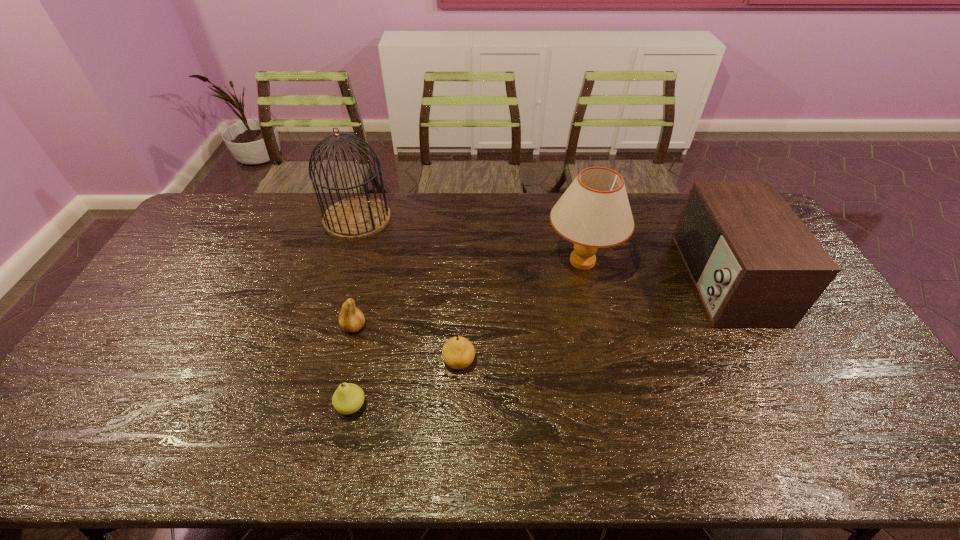
Identify the location of birdcage. (357, 217).

The height and width of the screenshot is (540, 960). Find the location of `lampshade`. lampshade is located at coordinates (594, 212).

Find the location of a particular element. The image size is (960, 540). radio receiver is located at coordinates (754, 264).

Identify the location of the rightmost object. (754, 264).

Image resolution: width=960 pixels, height=540 pixels. In order to click on the farthest pear in this screenshot , I will do `click(351, 319)`.

This screenshot has width=960, height=540. Identify the location of the second nearest object. click(x=458, y=352).

This screenshot has height=540, width=960. What are the coordinates of `the third object from right to left` in the screenshot? It's located at (458, 352).

Locate an element on the screen. Image resolution: width=960 pixels, height=540 pixels. the nearest object is located at coordinates (348, 398).

You are a GUI agent. You are given a task and a screenshot of the screen. Output one action in this format:
    pyautogui.click(x=<x>, y=<y>)
    Task: Click on the vacant space located 0.170m at the door of the birdcage
    The width and height of the screenshot is (960, 540).
    Given the screenshot: What is the action you would take?
    pyautogui.click(x=437, y=218)

Find the location of a particular element. The width and height of the screenshot is (960, 540). vacant space located on the back of the second object from right to left is located at coordinates (574, 225).